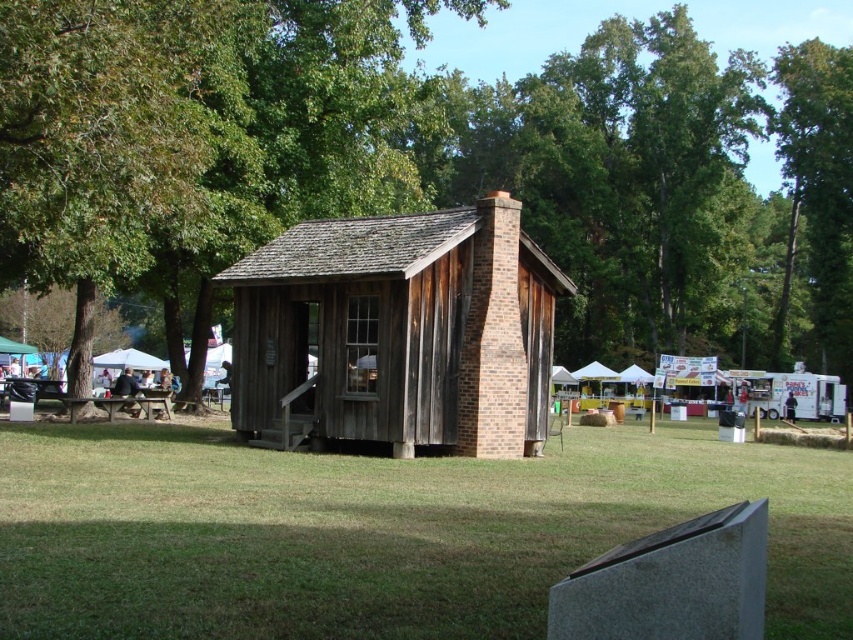
You are standing at the entrance of the rustic wooden cabin and notice two points marked on the ground. The first point is at coordinate point[544,429] and the second is at point[126,406]. Which point is closer to you?

Point[544,429] is in front of point[126,406], so it is closer to you.

You are standing in front of the cabin and notice two points marked in the scene. The first point is located at coordinates point [15,188] and the second at point [689,484]. Which point is closer to you?

Point [15,188] is further to the camera than point [689,484]. Therefore, point [689,484] is closer to you.